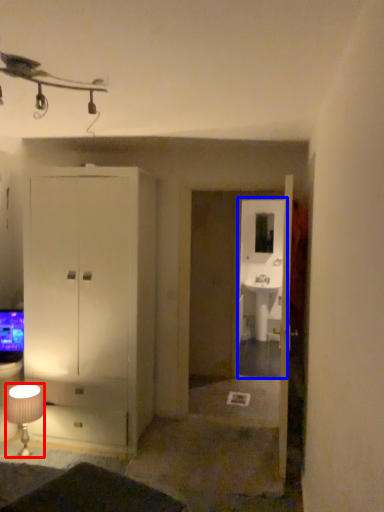
Question: Which object is further to the camera taking this photo, lamp (highlighted by a red box) or glass door (highlighted by a blue box)?

Choices:
 (A) lamp
 (B) glass door

Answer: (B)